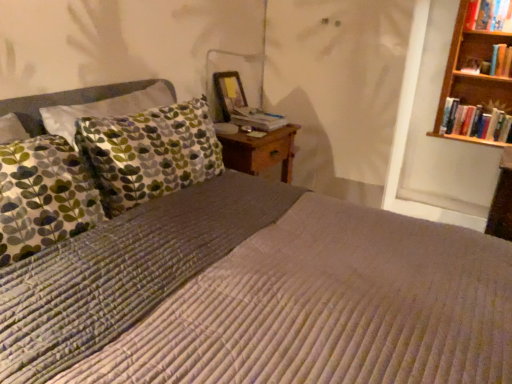
This screenshot has height=384, width=512. I want to click on vacant area situated below hardcover book at upper right, which ranks as the 2th book in top-to-bottom order (from a real-world perspective), so click(488, 105).